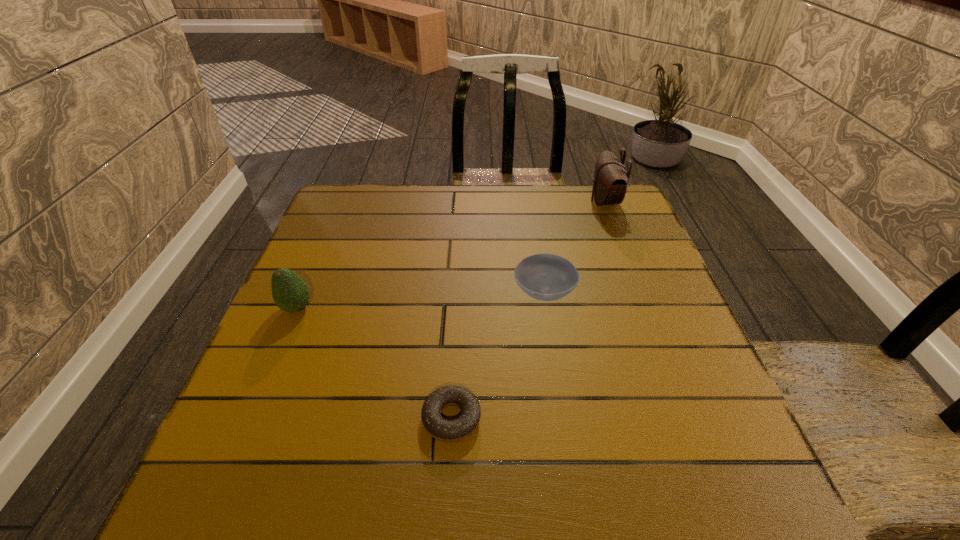
Where is `vacant space located with the flap open on the farthest object`? vacant space located with the flap open on the farthest object is located at coordinates (508, 201).

Identify the location of vacant space located 0.060m on the right of the avocado. Image resolution: width=960 pixels, height=540 pixels. (340, 308).

In order to click on vacant space located on the left of the bowl in this screenshot , I will do [417, 293].

Locate an element on the screen. This screenshot has width=960, height=540. free space located on the right of the shortest object is located at coordinates pyautogui.click(x=555, y=418).

Where is `object located at the far edge`? object located at the far edge is located at coordinates (611, 178).

The image size is (960, 540). I want to click on object that is at the left edge, so click(290, 292).

This screenshot has height=540, width=960. What are the coordinates of `object present at the right edge` in the screenshot? It's located at (611, 178).

Identify the location of object present at the far right corner. The height and width of the screenshot is (540, 960). (611, 178).

This screenshot has height=540, width=960. In order to click on free spot at the far edge of the desktop in this screenshot , I will do `click(397, 224)`.

This screenshot has height=540, width=960. What are the coordinates of `vacant area at the near edge` in the screenshot? It's located at (568, 469).